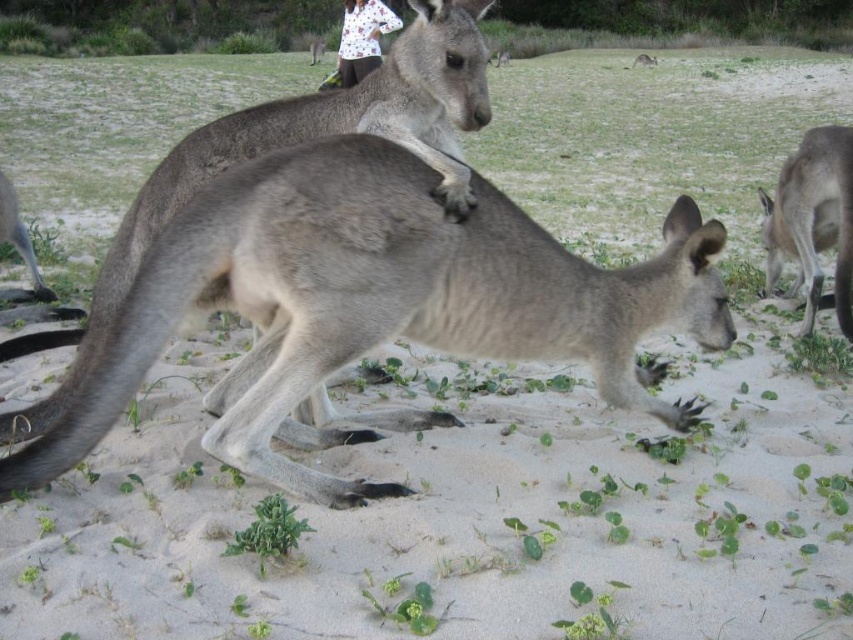
Between gray fur kangaroo at center and white printed shirt at upper center, which one is positioned lower?

gray fur kangaroo at center is below.

Between gray fur kangaroo at center and white printed shirt at upper center, which one is positioned higher?

Positioned higher is white printed shirt at upper center.

Measure the distance between gray fur kangaroo at center and camera.

6.67 feet

Locate an element on the screen. gray fur kangaroo at center is located at coordinates (374, 304).

Which is behind, point (770, 214) or point (341, 44)?

Positioned behind is point (341, 44).

Between gray fur kangaroo at right and white printed shirt at upper center, which one has more height?

With more height is white printed shirt at upper center.

Measure the distance between point [837,250] and camera.

Point [837,250] is 5.04 meters from camera.

In order to click on gray fur kangaroo at right in this screenshot , I will do `click(813, 220)`.

Can you confirm if gray fur kangaroo at right is positioned below gray fur kangaroo at lower left?

Actually, gray fur kangaroo at right is above gray fur kangaroo at lower left.

Which is below, gray fur kangaroo at right or gray fur kangaroo at lower left?

gray fur kangaroo at lower left

Is point (799, 192) in front of point (33, 284)?

Yes.

Where is `gray fur kangaroo at right`? The width and height of the screenshot is (853, 640). gray fur kangaroo at right is located at coordinates (813, 220).